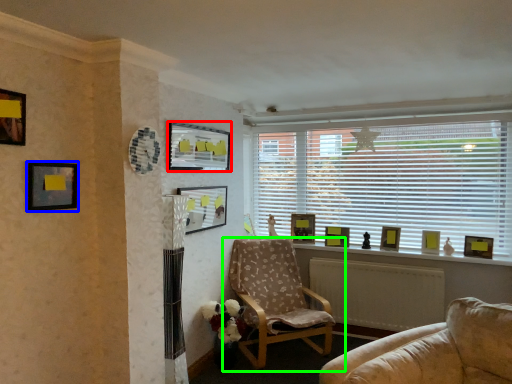
Question: Which object is positioned closest to picture frame (highlighted by a red box)? Select from picture frame (highlighted by a blue box) and chair (highlighted by a green box).

Choices:
 (A) picture frame
 (B) chair

Answer: (A)